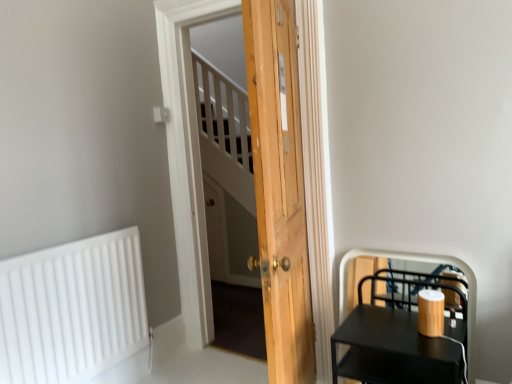
The height and width of the screenshot is (384, 512). What do you see at coordinates (279, 189) in the screenshot?
I see `natural wood door at center` at bounding box center [279, 189].

You are a GUI agent. You are given a task and a screenshot of the screen. Output one action in this format:
    pyautogui.click(x=<x>, y=<y>)
    Task: Click on the white matte radiator at lower left
    The image size is (512, 384).
    Given the screenshot: What is the action you would take?
    pyautogui.click(x=72, y=309)

This screenshot has width=512, height=384. I want to click on natural wood door at center, so click(279, 189).

Is natural wood door at center positioned with its back to black matte side table at lower right?

No, natural wood door at center is not facing the opposite direction of black matte side table at lower right.

Is natural wood door at center outside of black matte side table at lower right?

natural wood door at center is positioned outside black matte side table at lower right.

Considering the relative sizes of natural wood door at center and black matte side table at lower right in the image provided, is natural wood door at center wider than black matte side table at lower right?

Yes.

From their relative heights in the image, would you say natural wood door at center is taller or shorter than black matte side table at lower right?

Considering their sizes, natural wood door at center has more height than black matte side table at lower right.

Looking at this image, measure the distance between black matte side table at lower right and natural wood door at center.

They are 23.46 inches apart.

Is point (405, 373) farther from viewer compared to point (290, 3)?

That is False.

Is black matte side table at lower right beside natural wood door at center?

No, black matte side table at lower right is not touching natural wood door at center.

From a real-world perspective, which is physically below, black matte side table at lower right or natural wood door at center?

In real-world perspective, black matte side table at lower right is lower.

At what (x,y) coordinates should I click in order to perform the action: click on door on the right of white matte radiator at lower left. Please return your answer as a coordinate pair (x, y). Image resolution: width=512 pixels, height=384 pixels. Looking at the image, I should click on (279, 189).

Is natural wood door at center far away from white matte radiator at lower left?

That's right, there is a large distance between natural wood door at center and white matte radiator at lower left.

Consider the image. Is natural wood door at center in front of white matte radiator at lower left?

Yes, the depth of natural wood door at center is less than that of white matte radiator at lower left.

Is black matte side table at lower right not inside white matte radiator at lower left?

Absolutely, black matte side table at lower right is external to white matte radiator at lower left.

Between point (418, 366) and point (18, 365), which one is positioned in front?

Positioned in front is point (418, 366).

In terms of size, does black matte side table at lower right appear bigger or smaller than white matte radiator at lower left?

In the image, black matte side table at lower right appears to be larger than white matte radiator at lower left.

Are black matte side table at lower right and white matte radiator at lower left located far from each other?

Absolutely, black matte side table at lower right is distant from white matte radiator at lower left.

Considering the sizes of objects white matte radiator at lower left and natural wood door at center in the image provided, who is wider, white matte radiator at lower left or natural wood door at center?

natural wood door at center is wider.

Does white matte radiator at lower left have a larger size compared to natural wood door at center?

Actually, white matte radiator at lower left might be smaller than natural wood door at center.

Looking at this image, is white matte radiator at lower left at the right side of natural wood door at center?

In fact, white matte radiator at lower left is to the left of natural wood door at center.

How far apart are white matte radiator at lower left and natural wood door at center?

white matte radiator at lower left is 1.05 meters away from natural wood door at center.

Does white matte radiator at lower left have a larger size compared to black matte side table at lower right?

No.

Measure the distance from white matte radiator at lower left to black matte side table at lower right.

They are 4.19 feet apart.

Considering the relative positions of white matte radiator at lower left and black matte side table at lower right in the image provided, is white matte radiator at lower left to the right of black matte side table at lower right from the viewer's perspective?

Incorrect, white matte radiator at lower left is not on the right side of black matte side table at lower right.

You are a GUI agent. You are given a task and a screenshot of the screen. Output one action in this format:
    pyautogui.click(x=<x>, y=<y>)
    Task: Click on the door above the black matte side table at lower right (from the image's perspective)
    
    Given the screenshot: What is the action you would take?
    pyautogui.click(x=279, y=189)

Locate an element on the screen. furniture behind the natural wood door at center is located at coordinates (401, 334).

Looking at this image, looking at the image, which one is located closer to white matte radiator at lower left, black matte side table at lower right or natural wood door at center?

natural wood door at center is closer to white matte radiator at lower left.

Looking at this image, looking at the image, which one is located closer to natural wood door at center, white matte radiator at lower left or black matte side table at lower right?

black matte side table at lower right.

Looking at the image, which one is located further to white matte radiator at lower left, natural wood door at center or black matte side table at lower right?

black matte side table at lower right lies further to white matte radiator at lower left than the other object.

Based on their spatial positions, is natural wood door at center or white matte radiator at lower left closer to black matte side table at lower right?

natural wood door at center is positioned closer to the anchor black matte side table at lower right.

Which object lies nearer to the anchor point natural wood door at center, black matte side table at lower right or white matte radiator at lower left?

The object closer to natural wood door at center is black matte side table at lower right.

Estimate the real-world distances between objects in this image. Which object is closer to black matte side table at lower right, white matte radiator at lower left or natural wood door at center?

Among the two, natural wood door at center is located nearer to black matte side table at lower right.

Locate an element on the screen. door situated between white matte radiator at lower left and black matte side table at lower right from left to right is located at coordinates (279, 189).